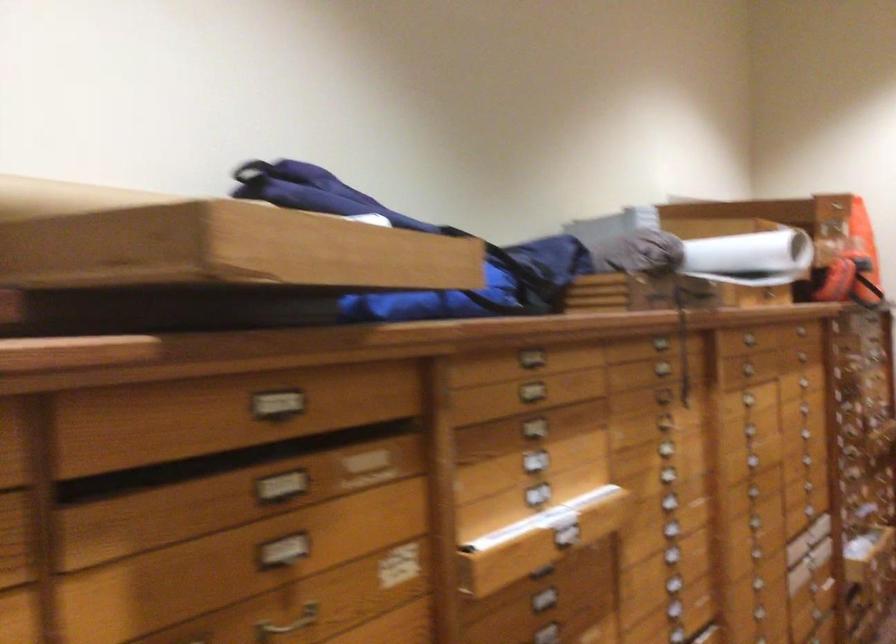
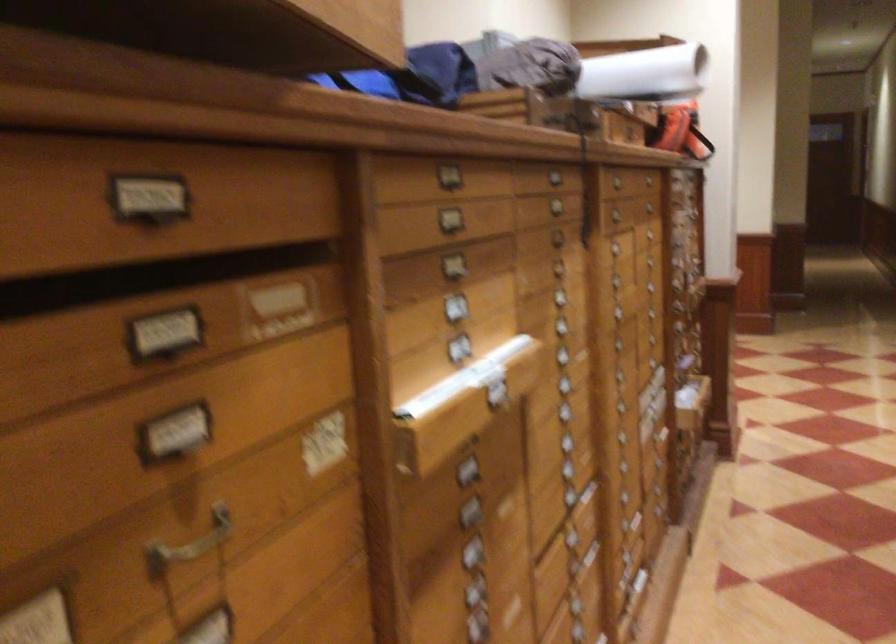
The images are taken continuously from a first-person perspective. In which direction are you moving?

The cameraman walked toward left, forward.